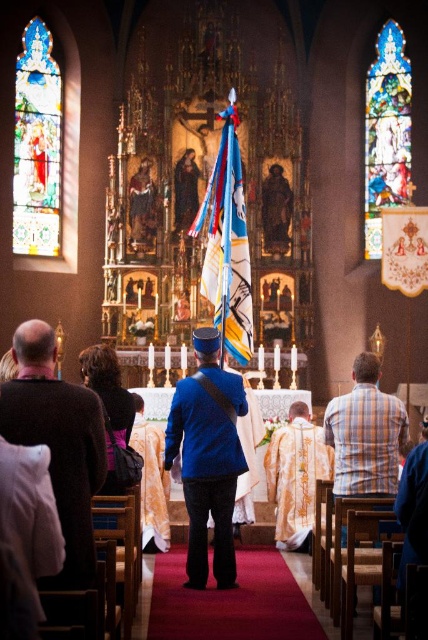
You are an attendee at the ceremony and want to know which clothing item is closer to the altar between the blue fabric uniform at center and the plaid shirt at center. Which one is closer?

The blue fabric uniform at center is below plaid shirt at center, so the plaid shirt at center is closer to the altar than the blue fabric uniform at center.

You are standing at the back of the church and see both the blue fabric uniform at center and the plaid shirt at center. Which one appears taller from your perspective?

The blue fabric uniform at center appears much taller than the plaid shirt at center from your perspective.

You are attending a religious ceremony in the church and notice two items at the center of the altar area. The blue fabric flag at center and the plaid shirt at center are both present. Based on their positions, which item is wider?

The blue fabric flag at center might be wider than plaid shirt at center according to the description provided.